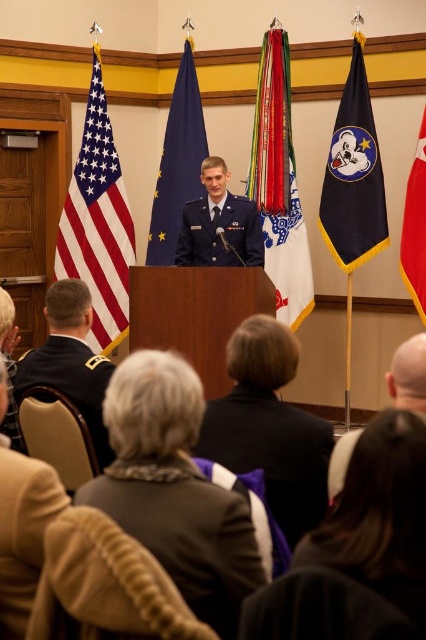
Between dark gray wool jacket at lower center and dark blue uniform at center, which one is positioned higher?

dark blue uniform at center

In the scene shown: Can you confirm if dark gray wool jacket at lower center is bigger than dark blue uniform at center?

No.

You are a GUI agent. You are given a task and a screenshot of the screen. Output one action in this format:
    pyautogui.click(x=<x>, y=<y>)
    Task: Click on the dark gray wool jacket at lower center
    The height and width of the screenshot is (640, 426).
    Given the screenshot: What is the action you would take?
    pyautogui.click(x=186, y=532)

From the picture: Can you confirm if dark gray wool jacket at lower center is wider than dark blue fabric uniform at center?

No.

Which is more to the right, dark gray wool jacket at lower center or dark blue fabric uniform at center?

dark blue fabric uniform at center is more to the right.

Who is more forward, (236, 506) or (189, 228)?

Point (236, 506)

At what (x,y) coordinates should I click in order to perform the action: click on dark gray wool jacket at lower center. Please return your answer as a coordinate pair (x, y). Looking at the image, I should click on (186, 532).

Describe the element at coordinates (23, 532) in the screenshot. I see `light brown fabric jacket at lower left` at that location.

Is light brown fabric jacket at lower left to the right of dark blue uniform at center from the viewer's perspective?

Yes, light brown fabric jacket at lower left is to the right of dark blue uniform at center.

The height and width of the screenshot is (640, 426). I want to click on light brown fabric jacket at lower left, so pos(23,532).